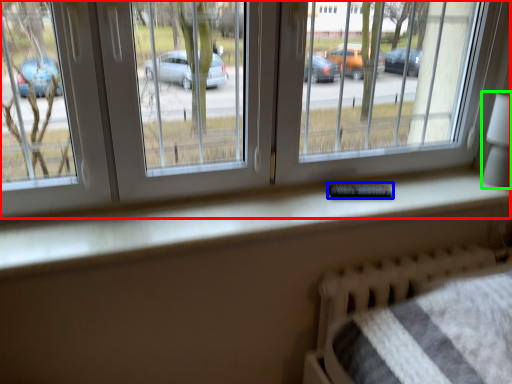
Question: Based on their relative distances, which object is nearer to window (highlighted by a red box)? Choose from remote (highlighted by a blue box) and table lamp (highlighted by a green box).

Choices:
 (A) remote
 (B) table lamp

Answer: (B)